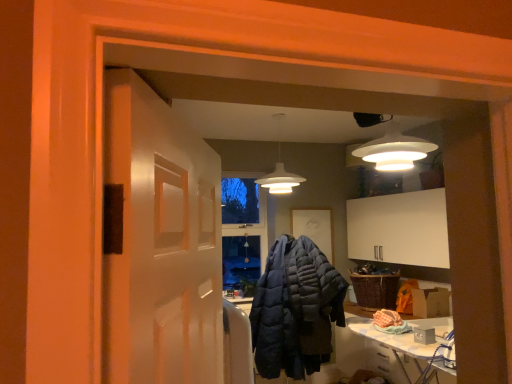
Question: From a real-world perspective, is dark blue quilted jacket at center physically above white matte pendant light at center?

Choices:
 (A) yes
 (B) no

Answer: (B)

Question: Can you confirm if dark blue quilted jacket at center is positioned to the right of white matte pendant light at center?

Choices:
 (A) no
 (B) yes

Answer: (B)

Question: Considering the relative sizes of dark blue quilted jacket at center and white matte pendant light at center in the image provided, is dark blue quilted jacket at center bigger than white matte pendant light at center?

Choices:
 (A) no
 (B) yes

Answer: (B)

Question: Is dark blue quilted jacket at center looking in the opposite direction of white matte pendant light at center?

Choices:
 (A) yes
 (B) no

Answer: (B)

Question: Is dark blue quilted jacket at center thinner than white matte pendant light at center?

Choices:
 (A) no
 (B) yes

Answer: (A)

Question: Considering their positions, is white matte pendant light at center located in front of or behind dark blue quilted jacket at center?

Choices:
 (A) behind
 (B) front

Answer: (A)

Question: From a real-world perspective, is white matte pendant light at center above or below dark blue quilted jacket at center?

Choices:
 (A) above
 (B) below

Answer: (A)

Question: Is white matte pendant light at center to the left or to the right of dark blue quilted jacket at center in the image?

Choices:
 (A) left
 (B) right

Answer: (A)

Question: Considering the positions of point (278, 153) and point (323, 259), is point (278, 153) closer or farther from the camera than point (323, 259)?

Choices:
 (A) closer
 (B) farther

Answer: (B)

Question: Would you say white ironing board at lower right is inside or outside dark blue quilted jacket at center?

Choices:
 (A) outside
 (B) inside

Answer: (A)

Question: Considering the relative positions of white ironing board at lower right and dark blue quilted jacket at center in the image provided, is white ironing board at lower right to the left or to the right of dark blue quilted jacket at center?

Choices:
 (A) left
 (B) right

Answer: (B)

Question: Based on their sizes in the image, would you say white ironing board at lower right is bigger or smaller than dark blue quilted jacket at center?

Choices:
 (A) small
 (B) big

Answer: (B)

Question: From a real-world perspective, is white ironing board at lower right above or below dark blue quilted jacket at center?

Choices:
 (A) below
 (B) above

Answer: (A)

Question: Considering the positions of white ironing board at lower right and white matte pendant light at center in the image, is white ironing board at lower right bigger or smaller than white matte pendant light at center?

Choices:
 (A) small
 (B) big

Answer: (B)

Question: Is white ironing board at lower right situated inside white matte pendant light at center or outside?

Choices:
 (A) inside
 (B) outside

Answer: (B)